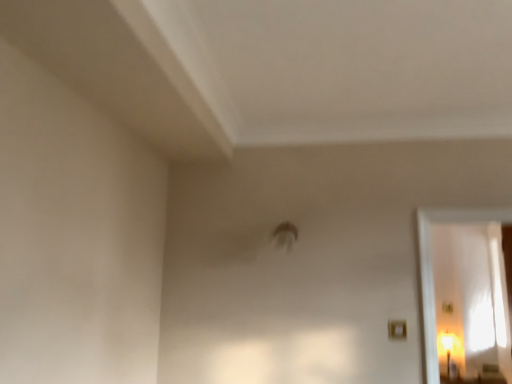
The image size is (512, 384). What do you see at coordinates (447, 348) in the screenshot? I see `matte glass lampshade at upper center` at bounding box center [447, 348].

You are a GUI agent. You are given a task and a screenshot of the screen. Output one action in this format:
    pyautogui.click(x=<x>, y=<y>)
    Task: Click on the matte glass lampshade at upper center
    The height and width of the screenshot is (384, 512).
    Given the screenshot: What is the action you would take?
    pyautogui.click(x=447, y=348)

What is the approximate width of matte glass lampshade at upper center?

The width of matte glass lampshade at upper center is 6.61 inches.

At what (x,y) coordinates should I click in order to perform the action: click on matte glass lampshade at upper center. Please return your answer as a coordinate pair (x, y). The height and width of the screenshot is (384, 512). Looking at the image, I should click on (447, 348).